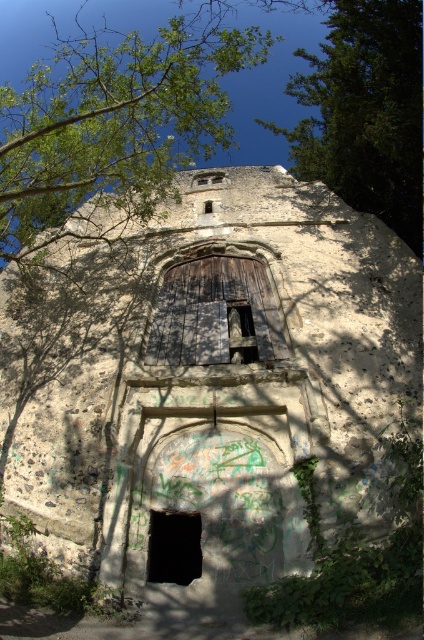
You are standing in front of the old stone building and want to take a photo of the green leafy tree at upper left. Where should you position your camera to capture it in the frame?

Position the camera so that it faces the upper left area of the building, specifically targeting the coordinates at point (x=114, y=124) where the green leafy tree at upper left is located.

You are standing at the entrance of the old stone building and notice two points marked on the facade. The first point is at coordinate (250, 292) and the second is at (190, 528). Which point is closer to your current position?

Point (190, 528) is closer to your current position because it is in front of point (250, 292).